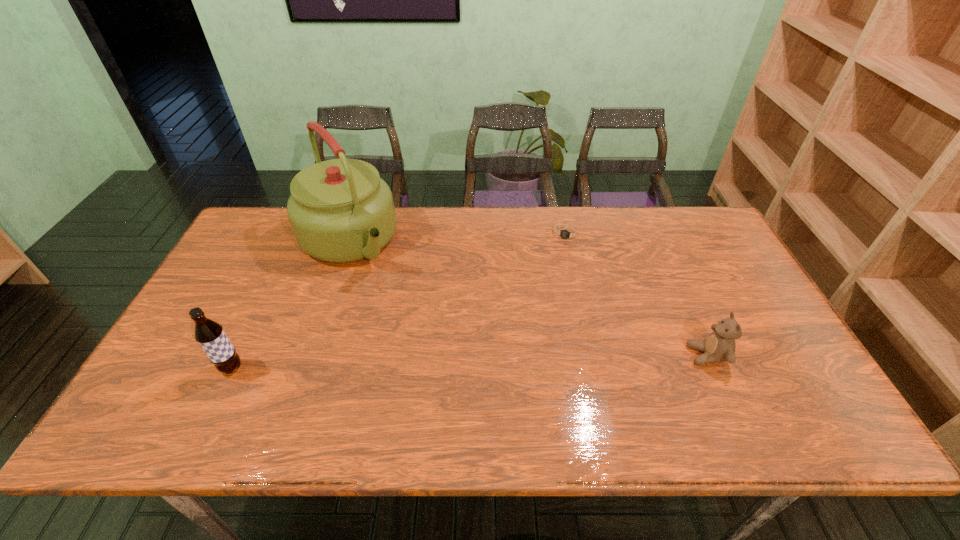
The width and height of the screenshot is (960, 540). I want to click on vacant space that satisfies the following two spatial constraints: 1. on the front side of the shortest object; 2. on the front-facing side of the rightmost object, so click(594, 355).

At what (x,y) coordinates should I click in order to perform the action: click on blank area in the image that satisfies the following two spatial constraints: 1. on the front side of the watch; 2. on the front-facing side of the rightmost object. Please return your answer as a coordinate pair (x, y). Looking at the image, I should click on (594, 355).

This screenshot has height=540, width=960. I want to click on free space that satisfies the following two spatial constraints: 1. on the front side of the watch; 2. on the front-facing side of the second shortest object, so click(x=594, y=355).